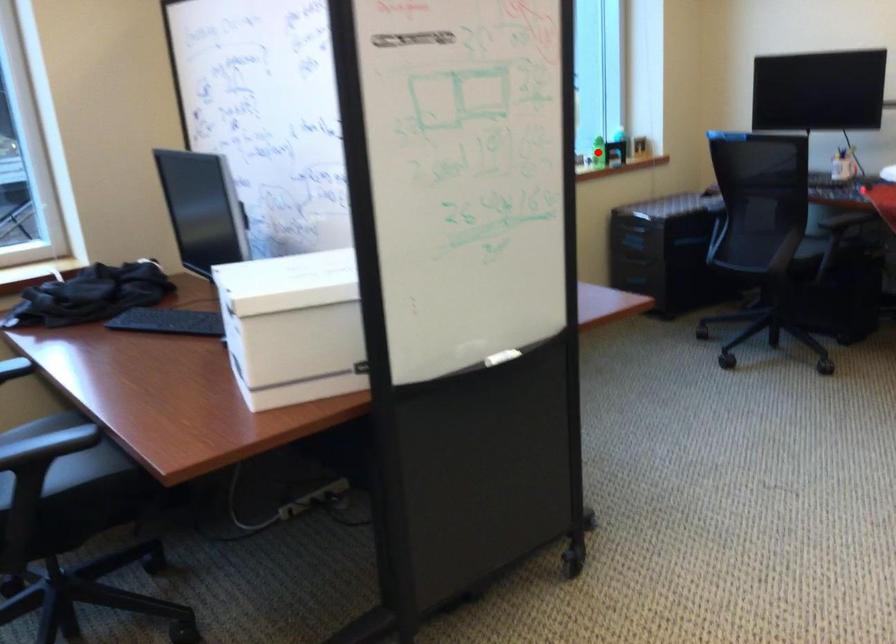
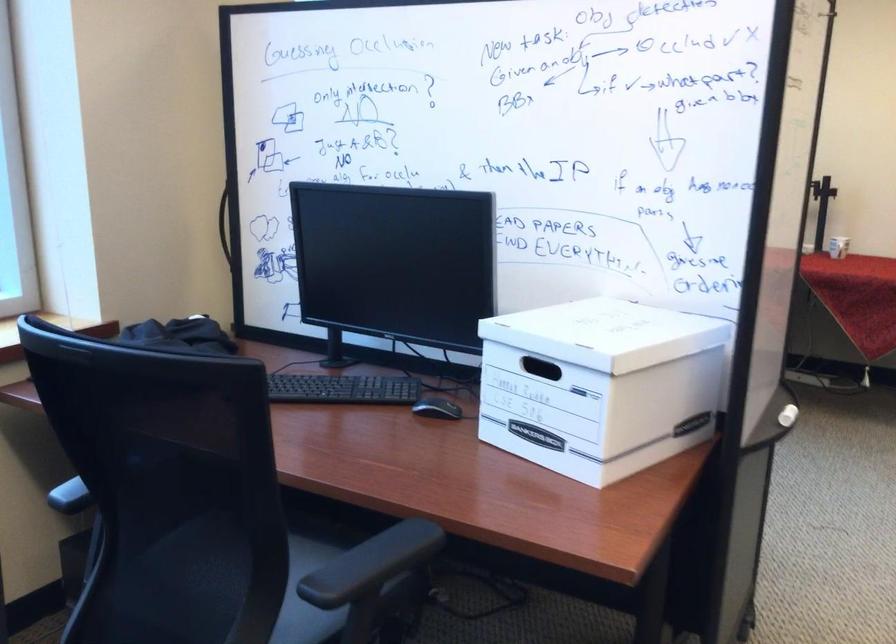
Question: I am providing you with two images of the same scene from different viewpoints. A red point is marked on the first image. Is the red point's position out of view in image 2?

Choices:
 (A) Yes
 (B) No

Answer: (A)